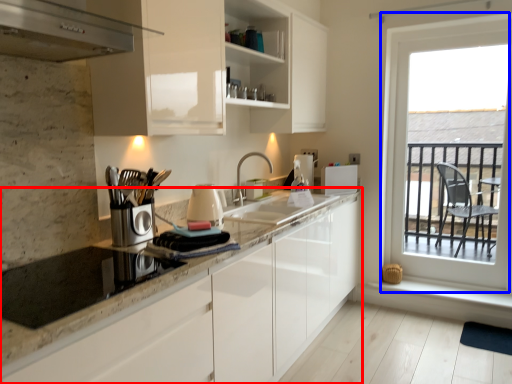
Question: Which point is closer to the camera, countertop (highlighted by a red box) or window (highlighted by a blue box)?

Choices:
 (A) countertop
 (B) window

Answer: (A)